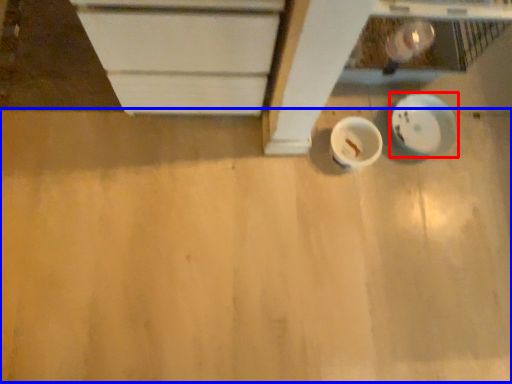
Question: Which object is further to the camera taking this photo, plate (highlighted by a red box) or plywood (highlighted by a blue box)?

Choices:
 (A) plate
 (B) plywood

Answer: (A)